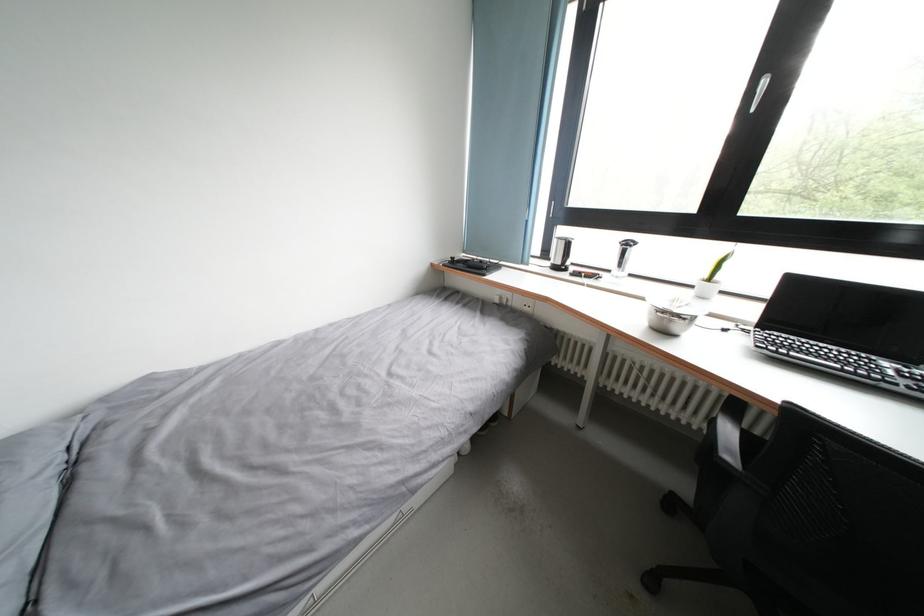
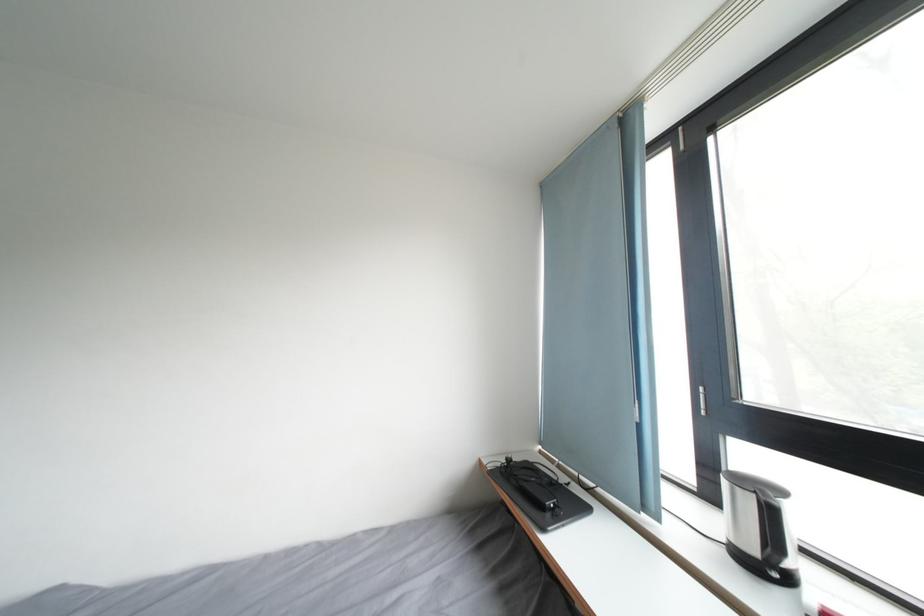
In the second image, find the point that corresponds to (529,267) in the first image.

(651, 514)